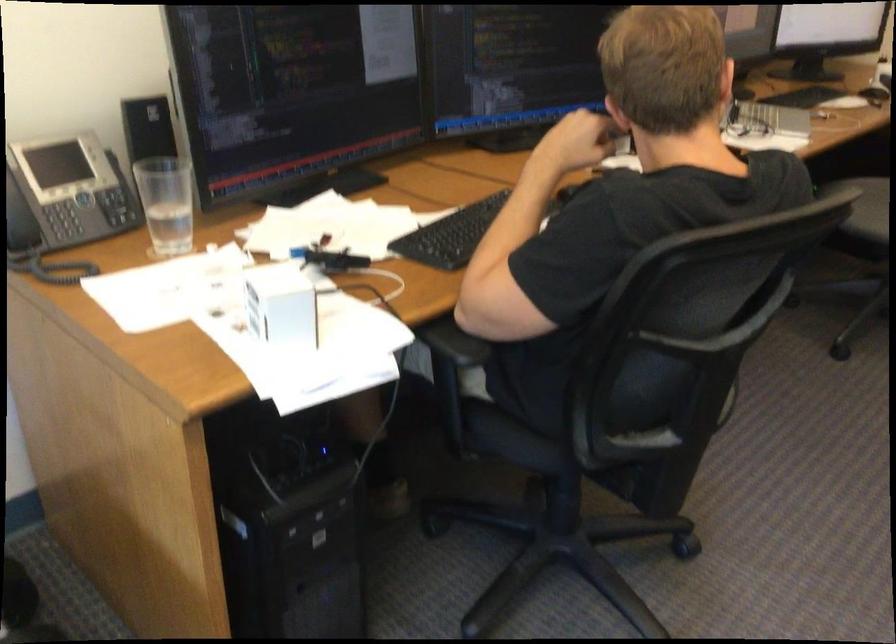
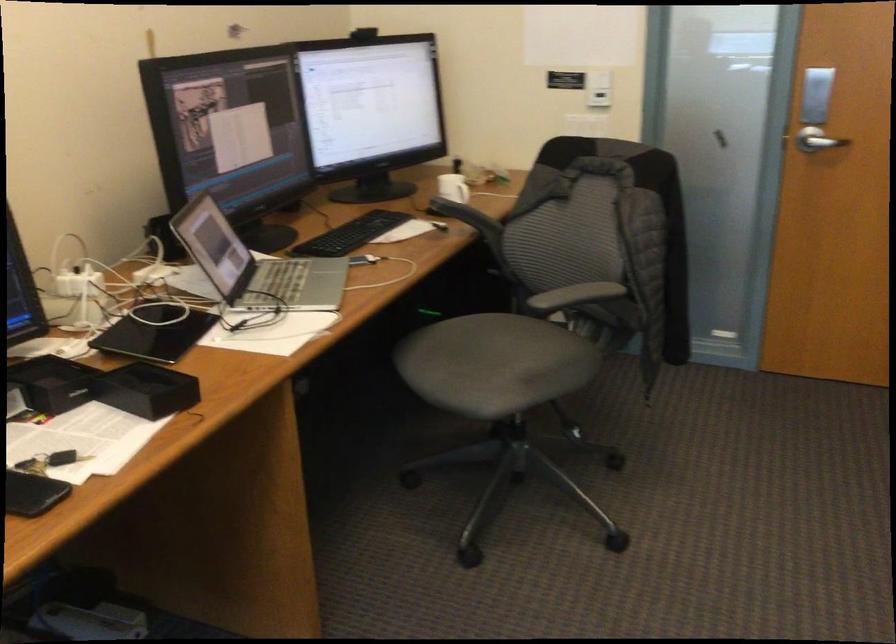
In a continuous first-person perspective shot, in which direction is the camera moving?

The cameraman walked toward right, forward.